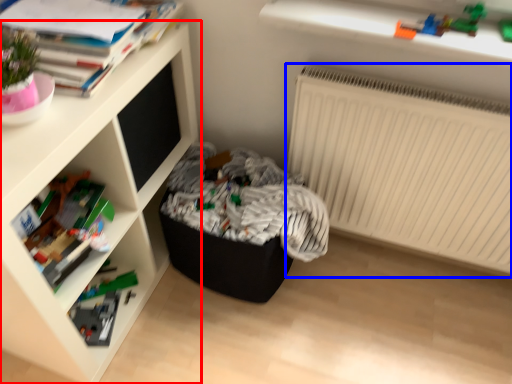
Question: Which object appears farthest to the camera in this image, shelf (highlighted by a red box) or radiator (highlighted by a blue box)?

Choices:
 (A) shelf
 (B) radiator

Answer: (B)